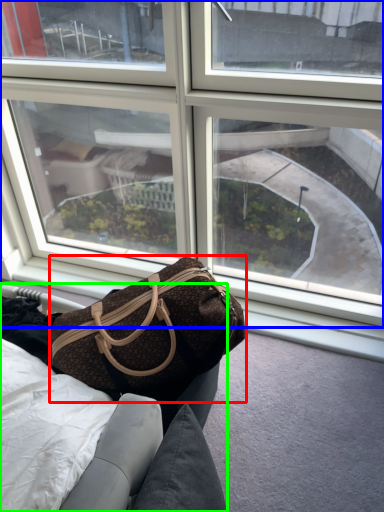
Question: Which is farther away from handbag (highlighted by a red box)? window (highlighted by a blue box) or furniture (highlighted by a green box)?

Choices:
 (A) window
 (B) furniture

Answer: (A)